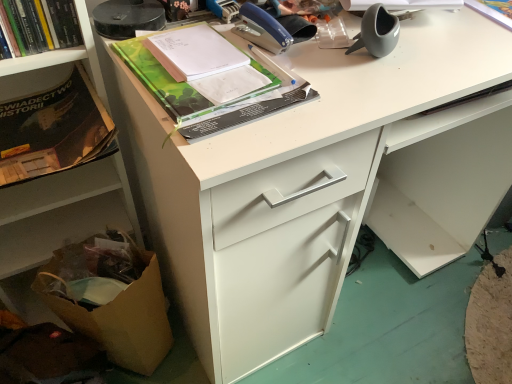
Identify the location of free space between green matte book at upper center, the second book when ordered from left to right, and matte gray vase at upper right, the 1th office supplies positioned from the right. The image size is (512, 384). (320, 60).